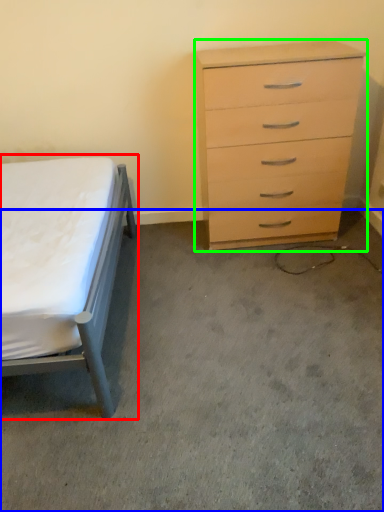
Question: Which is nearer to the bed (highlighted by a red box)? concrete (highlighted by a blue box) or chest of drawers (highlighted by a green box).

Choices:
 (A) concrete
 (B) chest of drawers

Answer: (A)